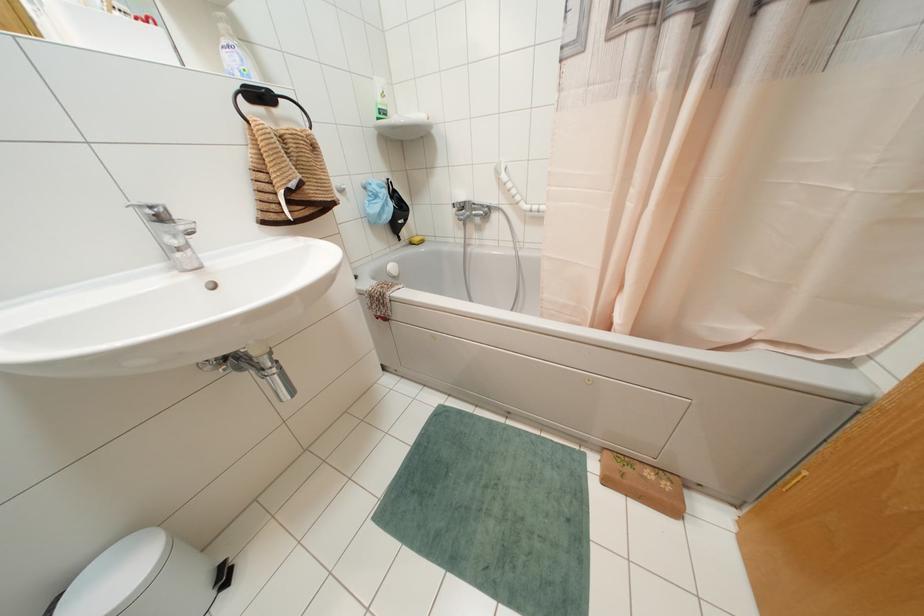
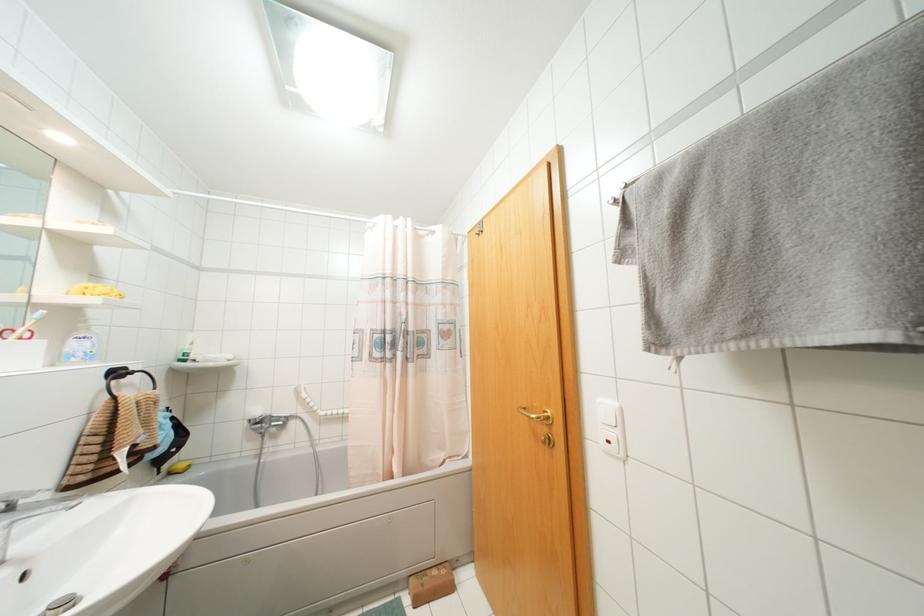
Where in the second image is the point corresponding to pixel 409 243 from the first image?

(169, 472)